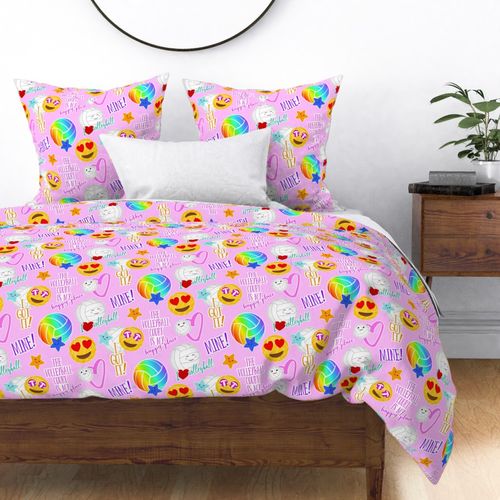
The image size is (500, 500). I want to click on wooden side table, so point(446,226).